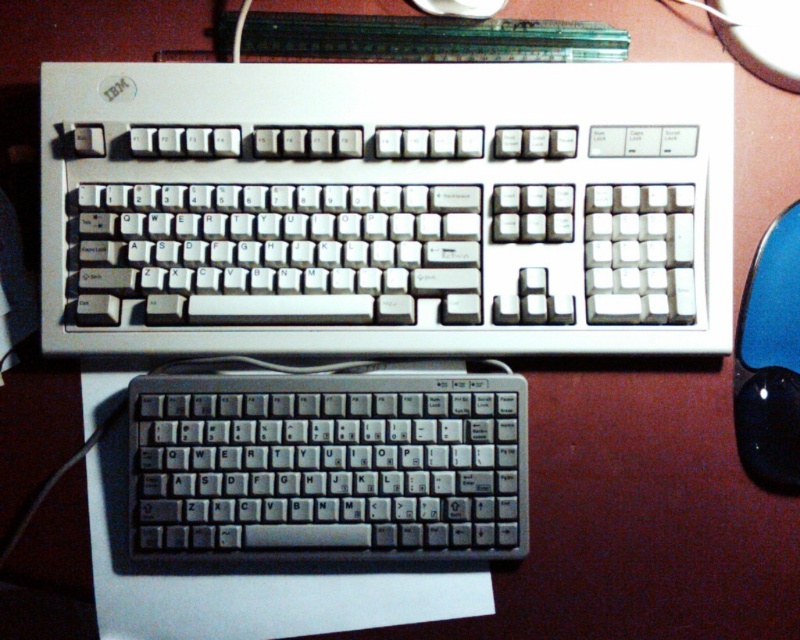
Can you confirm if white plastic keyboard at center is positioned above black glossy mouse at right?

Correct, white plastic keyboard at center is located above black glossy mouse at right.

Is point (281, 81) farther from camera compared to point (792, 474)?

Yes.

Which is in front, point (325, 188) or point (794, 486)?

Point (794, 486)

Find the location of a particular element. This screenshot has height=640, width=800. white plastic keyboard at center is located at coordinates (386, 209).

Between silver metallic keyboard at lower center and black glossy mouse at right, which one has more height?

With more height is black glossy mouse at right.

Does silver metallic keyboard at lower center have a lesser width compared to black glossy mouse at right?

Incorrect, silver metallic keyboard at lower center's width is not less than black glossy mouse at right's.

Where is `silver metallic keyboard at lower center`? silver metallic keyboard at lower center is located at coordinates (329, 465).

What do you see at coordinates (386, 209) in the screenshot? The height and width of the screenshot is (640, 800). I see `white plastic keyboard at center` at bounding box center [386, 209].

Between white plastic keyboard at center and silver metallic keyboard at lower center, which one is positioned lower?

silver metallic keyboard at lower center is below.

The height and width of the screenshot is (640, 800). In order to click on white plastic keyboard at center in this screenshot , I will do `click(386, 209)`.

The width and height of the screenshot is (800, 640). Find the location of `white plastic keyboard at center`. white plastic keyboard at center is located at coordinates (386, 209).